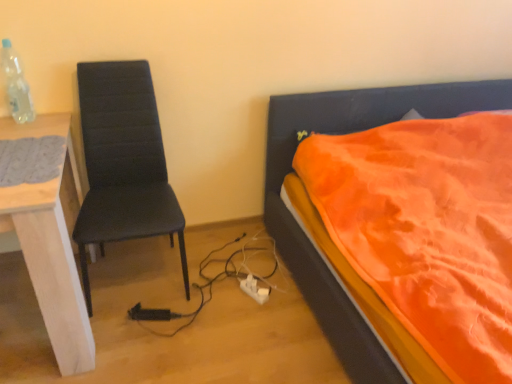
The image size is (512, 384). Find the location of `spots to the right of white wood desk at left`. spots to the right of white wood desk at left is located at coordinates (186, 317).